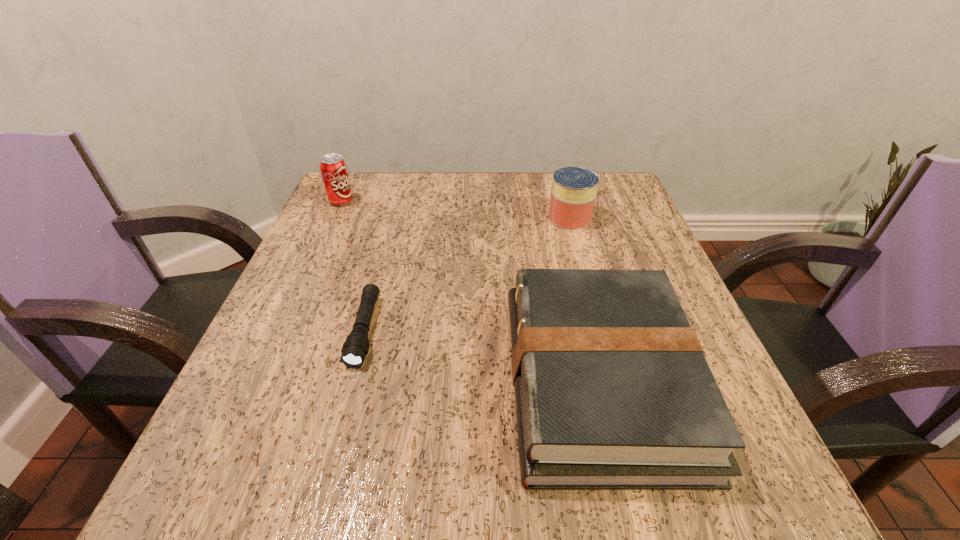
Identify the location of vacant space located at the lens end of the flashlight. (335, 441).

Where is `soda present at the far edge`? The image size is (960, 540). soda present at the far edge is located at coordinates (333, 167).

Find the location of `can present at the far edge`. can present at the far edge is located at coordinates (574, 189).

The height and width of the screenshot is (540, 960). Find the location of `object located in the near edge section of the desktop`. object located in the near edge section of the desktop is located at coordinates (612, 389).

Identify the location of soda located in the left edge section of the desktop. (333, 167).

This screenshot has height=540, width=960. I want to click on flashlight that is at the left edge, so click(355, 348).

Where is `can located at the right edge`? The height and width of the screenshot is (540, 960). can located at the right edge is located at coordinates (574, 189).

The width and height of the screenshot is (960, 540). I want to click on hardback book positioned at the right edge, so click(612, 389).

Image resolution: width=960 pixels, height=540 pixels. Find the location of `object that is at the far left corner`. object that is at the far left corner is located at coordinates (333, 167).

Where is `object that is at the far right corner`? Image resolution: width=960 pixels, height=540 pixels. object that is at the far right corner is located at coordinates (574, 189).